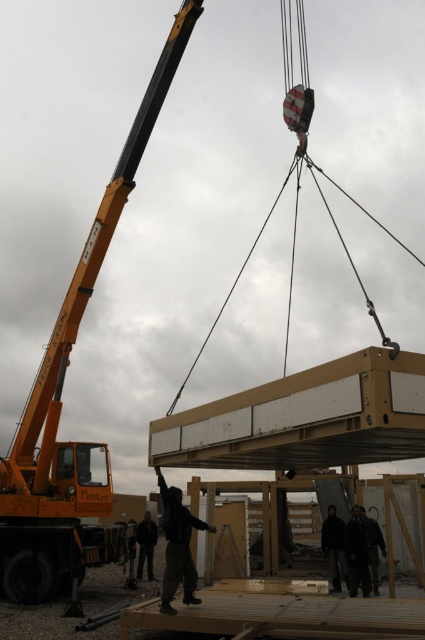
Is black matte clothing at center to the right of black fabric at lower center from the viewer's perspective?

No, black matte clothing at center is not to the right of black fabric at lower center.

Find the location of a particular element. This screenshot has width=425, height=640. black matte clothing at center is located at coordinates (178, 545).

What are the coordinates of `black matte clothing at center` in the screenshot? It's located at pyautogui.click(x=178, y=545).

Does point (339, 582) come closer to viewer compared to point (147, 554)?

Yes, point (339, 582) is in front of point (147, 554).

Which of these two, black fabric at lower center or black fabric person at center, stands taller?

With more height is black fabric at lower center.

At what (x,y) coordinates should I click in order to perform the action: click on black fabric at lower center. Please return your answer as a coordinate pair (x, y). The image size is (425, 640). Looking at the image, I should click on (334, 547).

Does black matte clothing at center have a greater height compared to black fabric person at center?

Yes, black matte clothing at center is taller than black fabric person at center.

Who is more forward, (170, 548) or (152, 570)?

Positioned in front is point (170, 548).

Does point (163, 596) lie in front of point (142, 561)?

Yes, point (163, 596) is in front of point (142, 561).

What are the coordinates of `black matte clothing at center` in the screenshot? It's located at (178, 545).